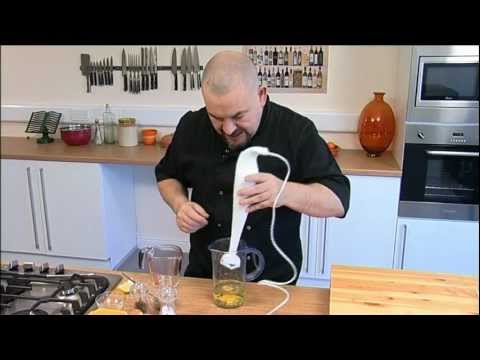
Identify the location of hand held blender. The height and width of the screenshot is (360, 480). (252, 166).